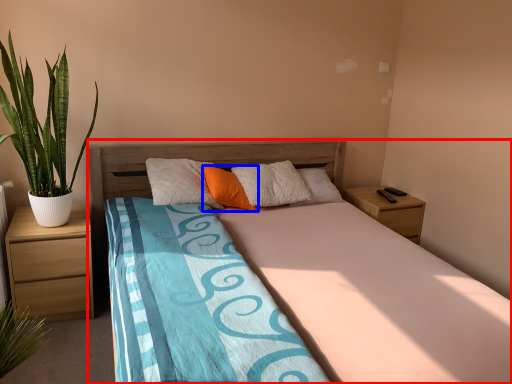
Question: Which point is closer to the camera, bed (highlighted by a red box) or pillow (highlighted by a blue box)?

Choices:
 (A) bed
 (B) pillow

Answer: (A)